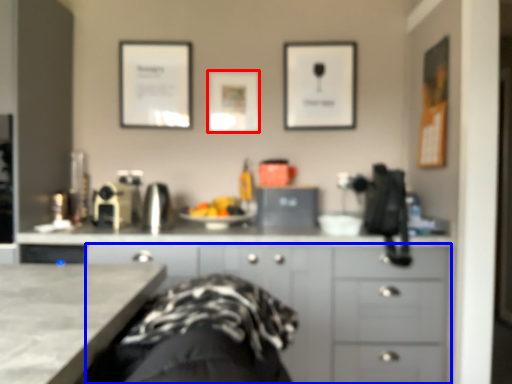
Question: Which object appears closest to the camera in this image, picture frame (highlighted by a red box) or cabinetry (highlighted by a blue box)?

Choices:
 (A) picture frame
 (B) cabinetry

Answer: (B)